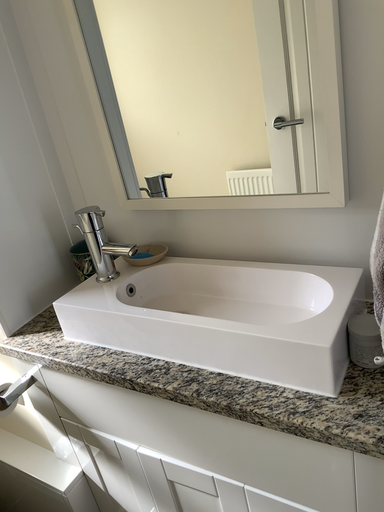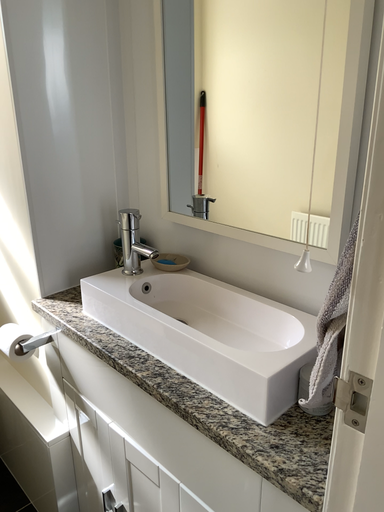
Question: How did the camera likely rotate when shooting the video?

Choices:
 (A) rotated left
 (B) rotated right

Answer: (A)